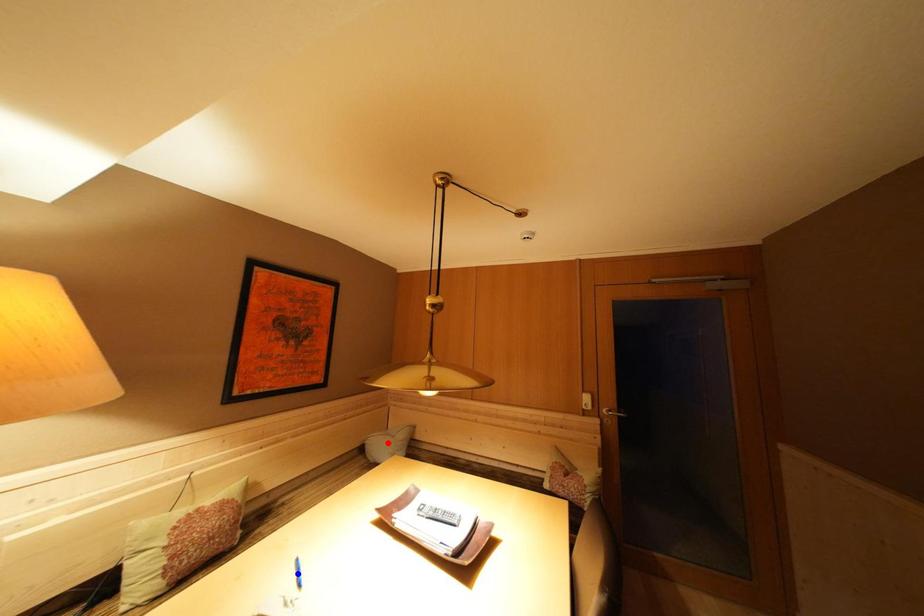
Question: In the image, two points are highlighted. Which point is nearer to the camera? Reply with the corresponding letter.

Choices:
 (A) blue point
 (B) red point

Answer: (A)